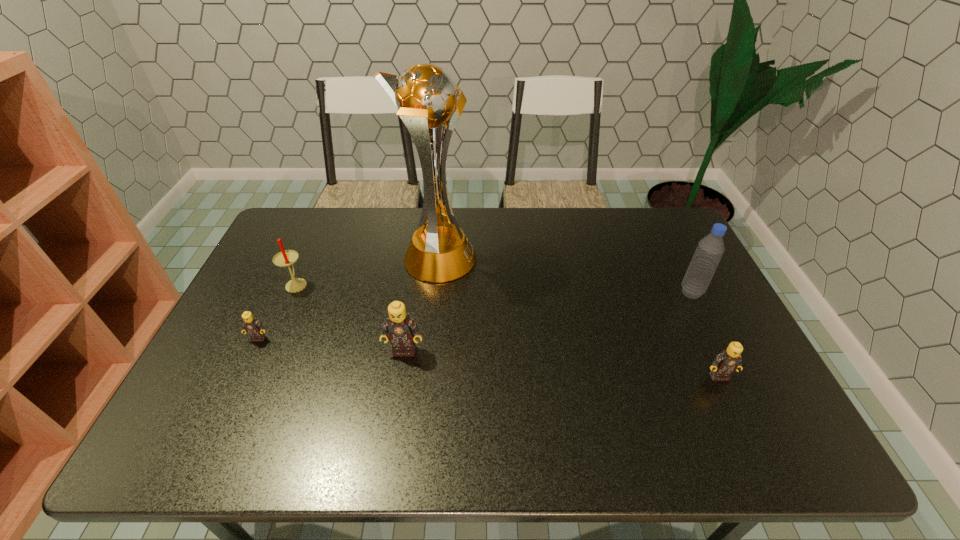
This screenshot has width=960, height=540. What are the coordinates of `vacant point located 0.160m in front of the second nearest object` in the screenshot? It's located at (395, 413).

The height and width of the screenshot is (540, 960). Find the location of `free space located 0.050m in front of the fifth tallest object`. free space located 0.050m in front of the fifth tallest object is located at coordinates (730, 399).

In order to click on vacant space located on the front-facing side of the tallest object in this screenshot , I will do `click(529, 260)`.

You are a GUI agent. You are given a task and a screenshot of the screen. Output one action in this format:
    pyautogui.click(x=<x>, y=<y>)
    Task: Click on the vacant space located 0.360m on the back of the candle
    
    Given the screenshot: What is the action you would take?
    pyautogui.click(x=330, y=208)

Where is `vacant space positioned on the front of the bottle`? The height and width of the screenshot is (540, 960). vacant space positioned on the front of the bottle is located at coordinates (742, 394).

Where is `object at the far edge`? This screenshot has width=960, height=540. object at the far edge is located at coordinates (429, 102).

Where is `Lego that is positioned at the left edge`? Lego that is positioned at the left edge is located at coordinates (250, 325).

Image resolution: width=960 pixels, height=540 pixels. Find the location of `candle that is at the left edge`. candle that is at the left edge is located at coordinates (284, 258).

Find the location of a particular element. The height and width of the screenshot is (540, 960). Lego present at the right edge is located at coordinates (728, 361).

At what (x,y) coordinates should I click in order to perform the action: click on bottle that is at the right edge. Please return your answer as a coordinate pair (x, y). This screenshot has height=540, width=960. Looking at the image, I should click on (710, 249).